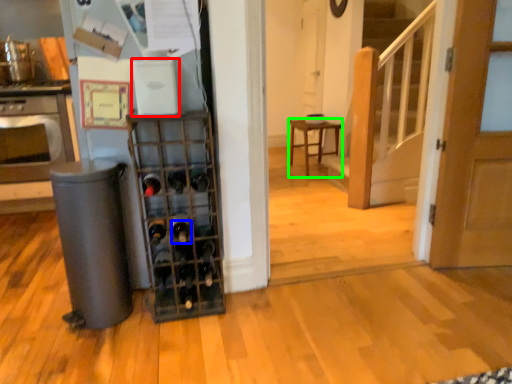
Question: Which is farther away from appliance (highlighted by a red box)? wine bottle (highlighted by a blue box) or furniture (highlighted by a green box)?

Choices:
 (A) wine bottle
 (B) furniture

Answer: (B)